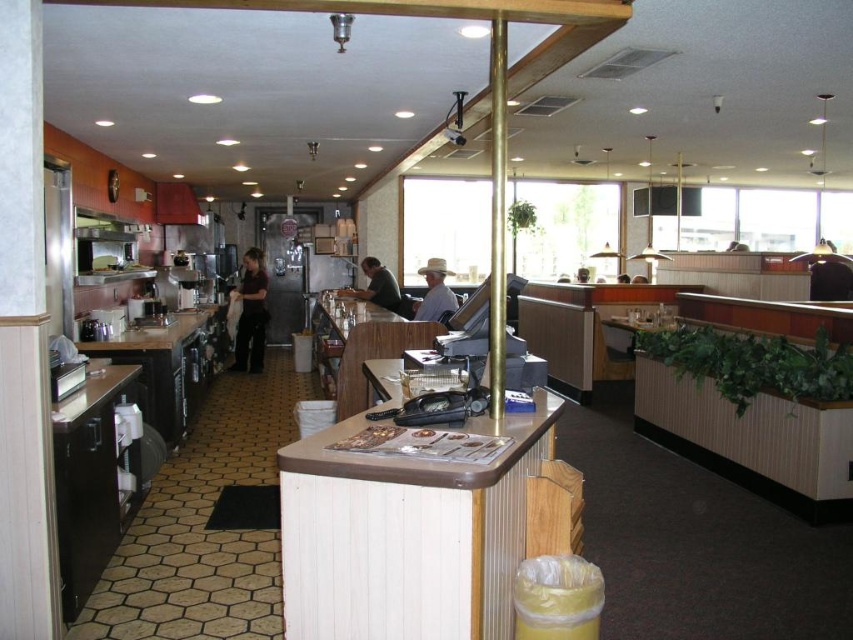
You are standing in the diner and want to reach a menu displayed on the counter. You notice two points marked in the image. Which point, point (428,284) or point (585,268), is closer to you?

Point (428,284) is closer to the viewer than point (585,268).